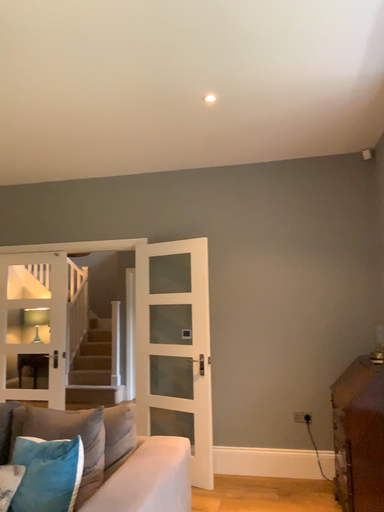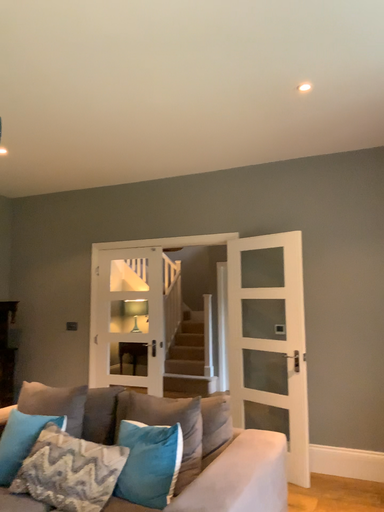
Question: Which way did the camera rotate in the video?

Choices:
 (A) rotated right
 (B) rotated left

Answer: (B)